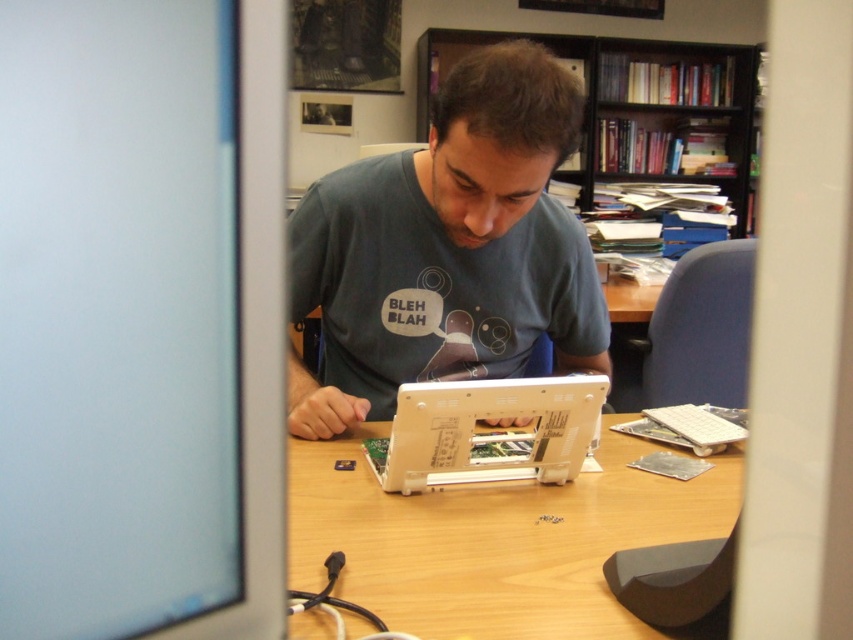
Who is positioned more to the right, wooden bookshelf at upper center or white plastic laptop at center?

wooden bookshelf at upper center

In order to click on wooden bookshelf at upper center in this screenshot , I will do `click(630, 104)`.

Can you confirm if gray matte shirt at center is positioned to the left of wooden bookshelf at upper center?

Indeed, gray matte shirt at center is positioned on the left side of wooden bookshelf at upper center.

Between gray matte shirt at center and wooden bookshelf at upper center, which one appears on the left side from the viewer's perspective?

gray matte shirt at center is more to the left.

The height and width of the screenshot is (640, 853). What are the coordinates of `gray matte shirt at center` in the screenshot? It's located at (447, 250).

I want to click on gray matte shirt at center, so click(x=447, y=250).

Which of these two, gray matte shirt at center or wooden table at center, stands shorter?

wooden table at center

Does gray matte shirt at center come behind wooden table at center?

Yes, it is.

Identify the location of gray matte shirt at center. (447, 250).

Identify the location of gray matte shirt at center. (447, 250).